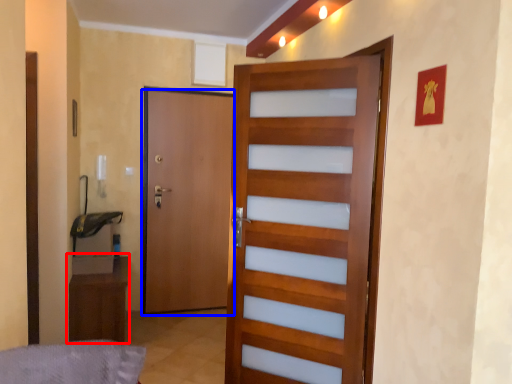
Question: Which object is further to the camera taking this photo, furniture (highlighted by a red box) or door (highlighted by a blue box)?

Choices:
 (A) furniture
 (B) door

Answer: (B)